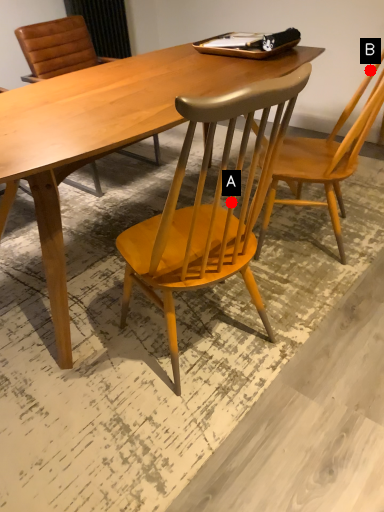
Question: Two points are circled on the image, labeled by A and B beside each circle. Among these points, which one is nearest to the camera?

Choices:
 (A) A is closer
 (B) B is closer

Answer: (A)